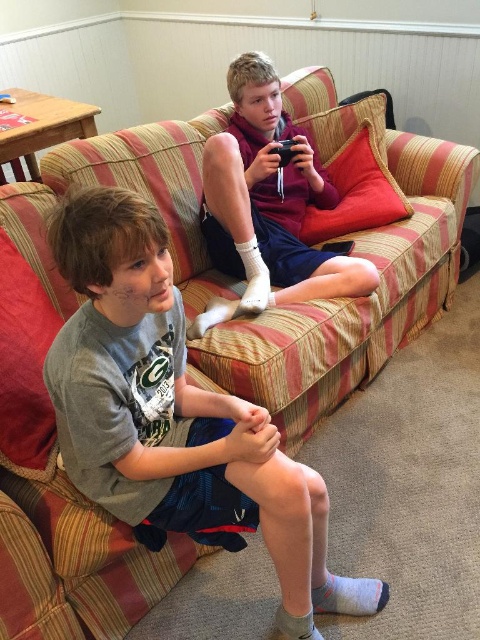
You are a fashion designer who wants to create a new outfit combining elements from both the gray cotton shirt at lower left and the matte purple hoodie at upper center. Which garment should you use as the base for the design if you want the final product to have a more compact and fitted look?

The gray cotton shirt at lower left has a smaller size compared to matte purple hoodie at upper center, so using the gray cotton shirt at lower left as the base would be better for a compact and fitted look since it is smaller in size.